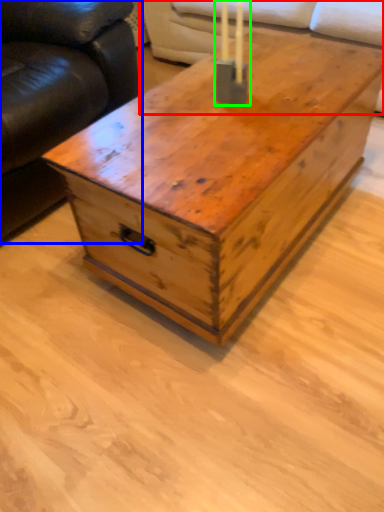
Question: Considering the real-world distances, which object is farthest from couch (highlighted by a red box)? studio couch (highlighted by a blue box) or candle holder (highlighted by a green box)?

Choices:
 (A) studio couch
 (B) candle holder

Answer: (B)